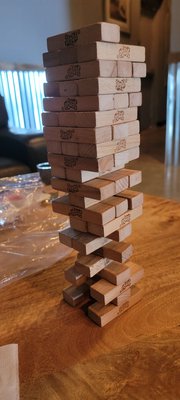
Find the location of a particular element. wall is located at coordinates (34, 30), (53, 6).